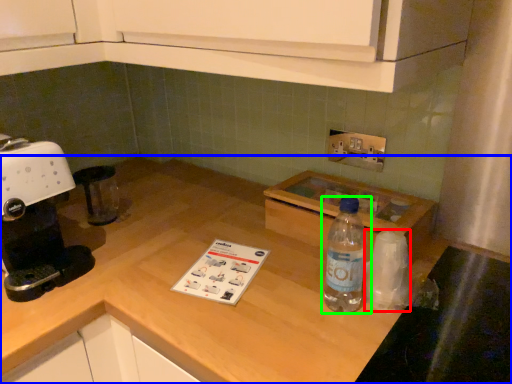
Question: Estimate the real-world distances between objects in this image. Which object is farther from paper towel (highlighted by a red box), countertop (highlighted by a blue box) or bottle (highlighted by a green box)?

Choices:
 (A) countertop
 (B) bottle

Answer: (A)